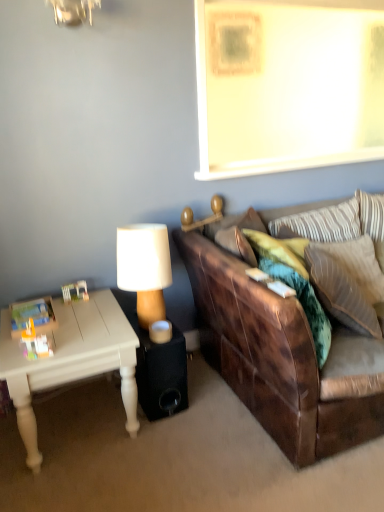
Locate an element on the screen. vacant space underneath white painted wood coffee table at lower left (from a real-world perspective) is located at coordinates (77, 417).